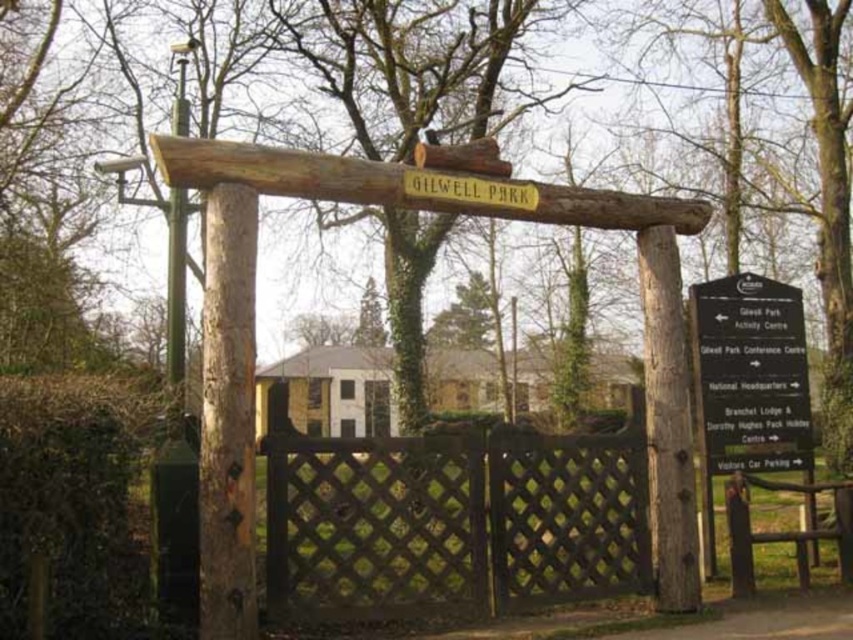
You are a visitor arriving at Gilwell Park and see the brown lattice fence at center and the black wood sign at right. Which object is located to the left of the other?

The brown lattice fence at center is positioned on the left side of black wood sign at right, so the brown lattice fence at center is to the left of the black wood sign at right.

You are standing at the entrance of Gilwell Park and want to find the main office. The brown lattice fence at center is located at coordinates point 0.811, 0.530. If you face the fence, which direction should you turn to locate the main office?

The main office is not mentioned in the provided scene description. The scene only describes the entrance gate, the brown lattice fence at center, and a black directional signpost to the right of the gate. Without additional information about the main office location, it is impossible to determine the direction to turn.

You are a visitor arriving at Gilwell Park and need to read the signpost to the right of the entrance. However, you are standing behind the fence. Can you still read the black wood sign at right clearly from your current position behind the brown lattice fence at center?

The brown lattice fence at center is larger in size than the black wood sign at right, so it might block your view of the sign. You may need to move closer or around the fence to read the black wood sign at right clearly.